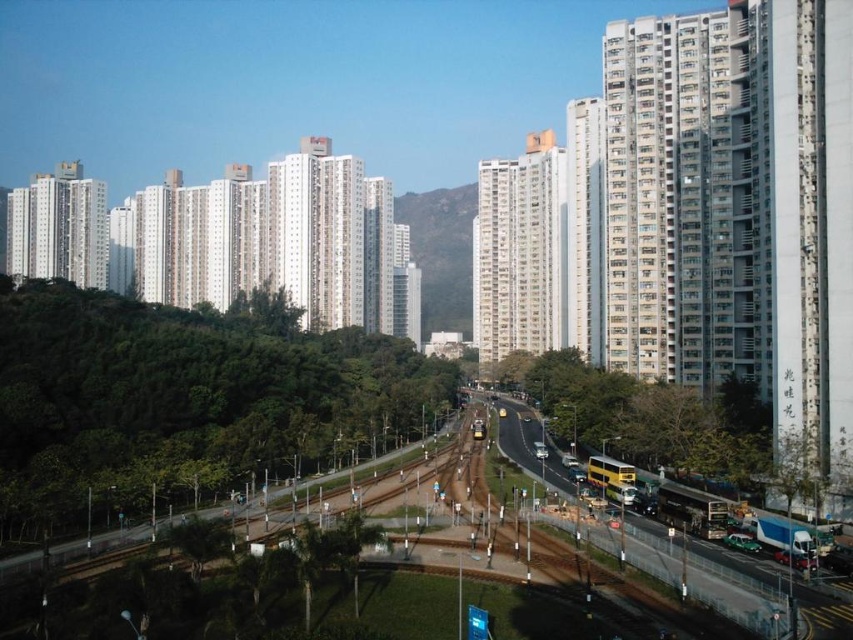
Can you confirm if yellow double-decker bus at center is positioned to the left of green textured hillside at center?

In fact, yellow double-decker bus at center is to the right of green textured hillside at center.

Can you confirm if yellow double-decker bus at center is bigger than green textured hillside at center?

Actually, yellow double-decker bus at center might be smaller than green textured hillside at center.

Who is more distant from viewer, (798, 620) or (447, 266)?

The point (447, 266) is more distant.

I want to click on yellow double-decker bus at center, so click(735, 582).